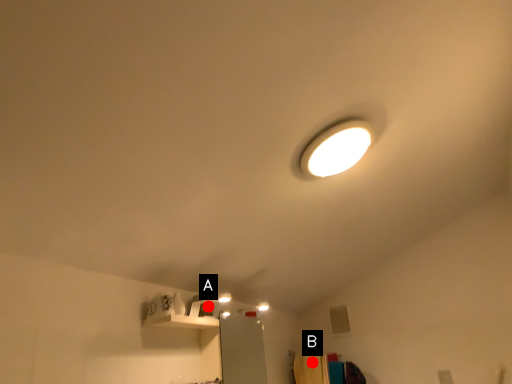
Question: Two points are circled on the image, labeled by A and B beside each circle. Which point is closer to the camera taking this photo?

Choices:
 (A) A is closer
 (B) B is closer

Answer: (A)